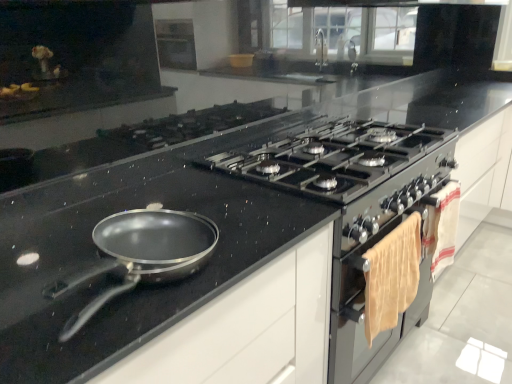
Question: Could you tell me if white cotton towel at right is turned towards matte silver oven at right?

Choices:
 (A) no
 (B) yes

Answer: (A)

Question: Is white cotton towel at right thinner than matte silver oven at right?

Choices:
 (A) no
 (B) yes

Answer: (B)

Question: Is white cotton towel at right taller than matte silver oven at right?

Choices:
 (A) no
 (B) yes

Answer: (B)

Question: Is white cotton towel at right positioned before matte silver oven at right?

Choices:
 (A) no
 (B) yes

Answer: (A)

Question: From the image's perspective, is white cotton towel at right under matte silver oven at right?

Choices:
 (A) yes
 (B) no

Answer: (B)

Question: Can you confirm if white cotton towel at right is bigger than matte silver oven at right?

Choices:
 (A) yes
 (B) no

Answer: (B)

Question: Is matte silver oven at right at the back of matte black countertop at center?

Choices:
 (A) yes
 (B) no

Answer: (B)

Question: Can you confirm if matte black countertop at center is shorter than matte silver oven at right?

Choices:
 (A) no
 (B) yes

Answer: (A)

Question: Can you confirm if matte black countertop at center is bigger than matte silver oven at right?

Choices:
 (A) yes
 (B) no

Answer: (A)

Question: Could you tell me if matte black countertop at center is turned towards matte silver oven at right?

Choices:
 (A) no
 (B) yes

Answer: (A)

Question: From a real-world perspective, is matte black countertop at center physically above matte silver oven at right?

Choices:
 (A) no
 (B) yes

Answer: (A)

Question: From the image's perspective, does matte black countertop at center appear higher than matte silver oven at right?

Choices:
 (A) no
 (B) yes

Answer: (A)

Question: Does matte silver oven at right have a greater height compared to black glass gas stove at center?

Choices:
 (A) no
 (B) yes

Answer: (B)